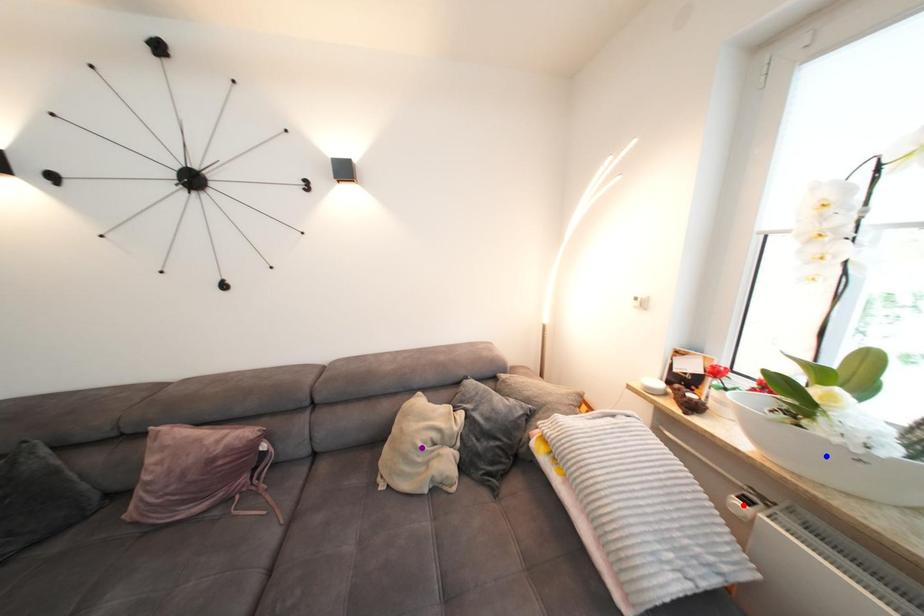
Order these from nearest to farthest:
red point
purple point
blue point

1. blue point
2. red point
3. purple point